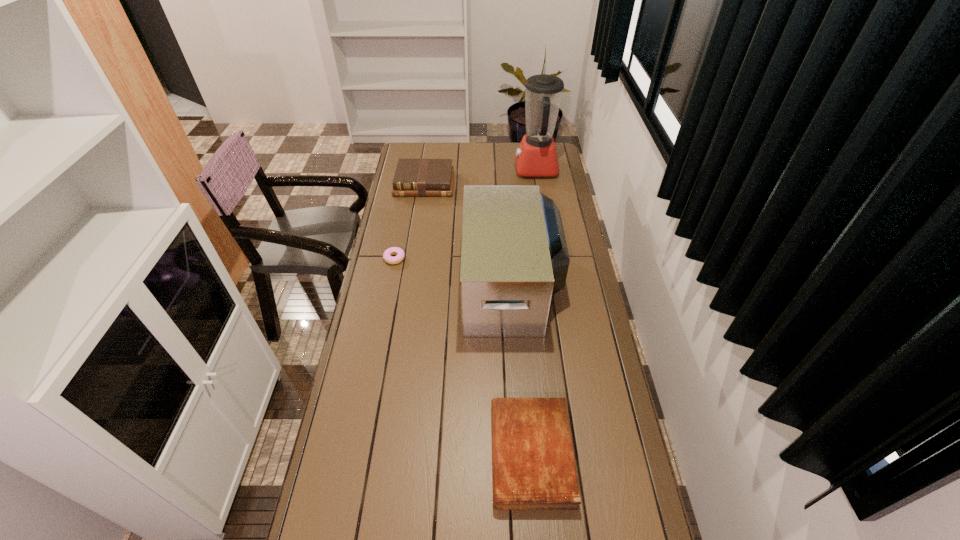
This screenshot has width=960, height=540. Find the location of `the tallest object`. the tallest object is located at coordinates (536, 156).

Where is `the fourth shortest object`? This screenshot has height=540, width=960. the fourth shortest object is located at coordinates (514, 257).

Where is `the farther Bible`? the farther Bible is located at coordinates (423, 177).

Image resolution: width=960 pixels, height=540 pixels. I want to click on the third shortest object, so click(423, 177).

Locate an element on the screen. the nearer Bible is located at coordinates (533, 462).

The width and height of the screenshot is (960, 540). What are the coordinates of `the fourth tallest object` in the screenshot? It's located at pyautogui.click(x=533, y=462).

The width and height of the screenshot is (960, 540). Identify the location of doughnut. (387, 256).

Where is `free space located 0.250m on the front of the tallest object near the controls`? free space located 0.250m on the front of the tallest object near the controls is located at coordinates (467, 168).

Find the location of `vacant area situated 0.160m on the front of the tallest object near the controls`. vacant area situated 0.160m on the front of the tallest object near the controls is located at coordinates (484, 168).

Find the location of `vacant area situated 0.070m on the front of the tallest object near the controls`. vacant area situated 0.070m on the front of the tallest object near the controls is located at coordinates (501, 168).